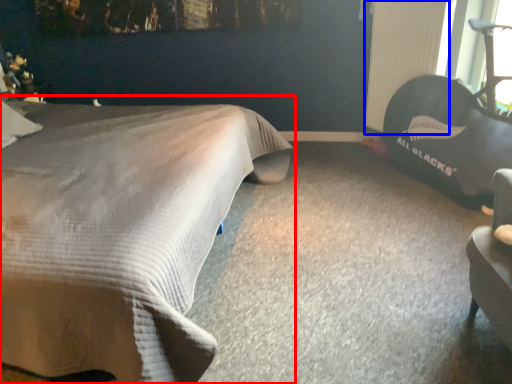
Question: Which object is closer to the camera taking this photo, bed (highlighted by a red box) or radiator (highlighted by a blue box)?

Choices:
 (A) bed
 (B) radiator

Answer: (A)